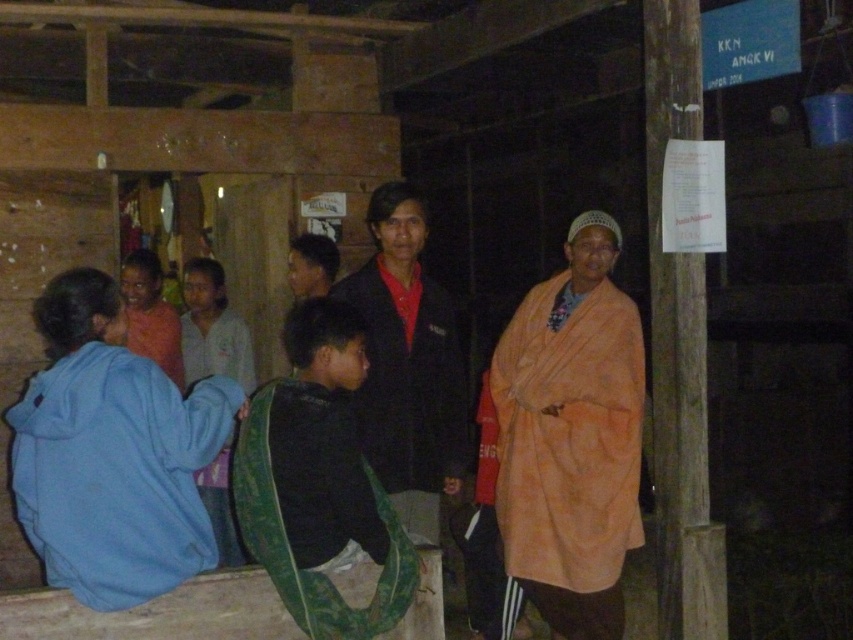
In the scene shown: You are a photographer trying to capture a clear shot of the matte orange robe at center without the orange fabric at center blocking it. What adjustment should you make to your camera position?

Move the camera backward so that the orange fabric at center is no longer in front of the matte orange robe at center, allowing the robe to be visible.

You are standing in the rustic wooden structure and want to move from point A to point B. Point A is at coordinates point (161, 566) and point B is at coordinates point (189, 262). Which point is closer to you when you start at point A?

Point A at coordinates point (161, 566) is closer to you than point B at coordinates point (189, 262) because the description states that point (161, 566) is closer to the viewer than point (189, 262).

You are standing in the rustic wooden structure and want to hand a document to the person wearing the blue fleece jacket at lower left. To reach them, you must pass by the light blue fabric at left. Which object should you approach first?

You should approach the blue fleece jacket at lower left first since it is closer to you than the light blue fabric at left.